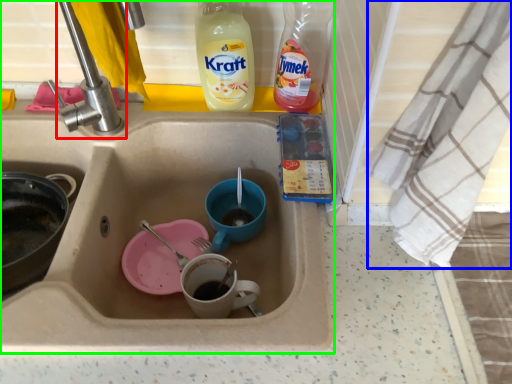
Question: Which object is positioned closest to tap (highlighted by a red box)? Select from cloth (highlighted by a blue box) and sink (highlighted by a green box).

Choices:
 (A) cloth
 (B) sink

Answer: (B)